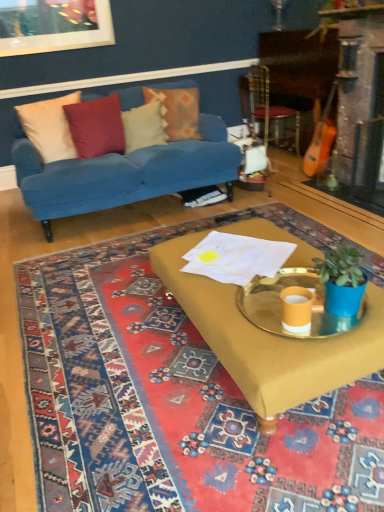
Question: Is metallic gold armchair at upper right wider or thinner than beige fabric pillow at left, positioned as the fourth pillow in right-to-left order?

Choices:
 (A) thin
 (B) wide

Answer: (B)

Question: Relative to beige fabric pillow at left, positioned as the fourth pillow in right-to-left order, is metallic gold armchair at upper right in front or behind?

Choices:
 (A) behind
 (B) front

Answer: (A)

Question: Considering the real-world distances, which object is closest to the beige fabric pillow at left, the 1th pillow viewed from the left?

Choices:
 (A) floral fabric pillow at upper center, positioned as the first pillow in right-to-left order
 (B) velvety red pillow at upper left, arranged as the third pillow when viewed from the right
 (C) velvet blue couch at upper left
 (D) metallic gold armchair at upper right
 (E) mustard fabric coffee table at center

Answer: (B)

Question: Based on their relative distances, which object is farther from the velvet blue couch at upper left?

Choices:
 (A) velvety red pillow at upper left, the 2th pillow from the left
 (B) metallic gold armchair at upper right
 (C) beige fabric pillow at left, positioned as the fourth pillow in right-to-left order
 (D) yellow fabric mat at center
 (E) blue matte plant pot at right

Answer: (E)